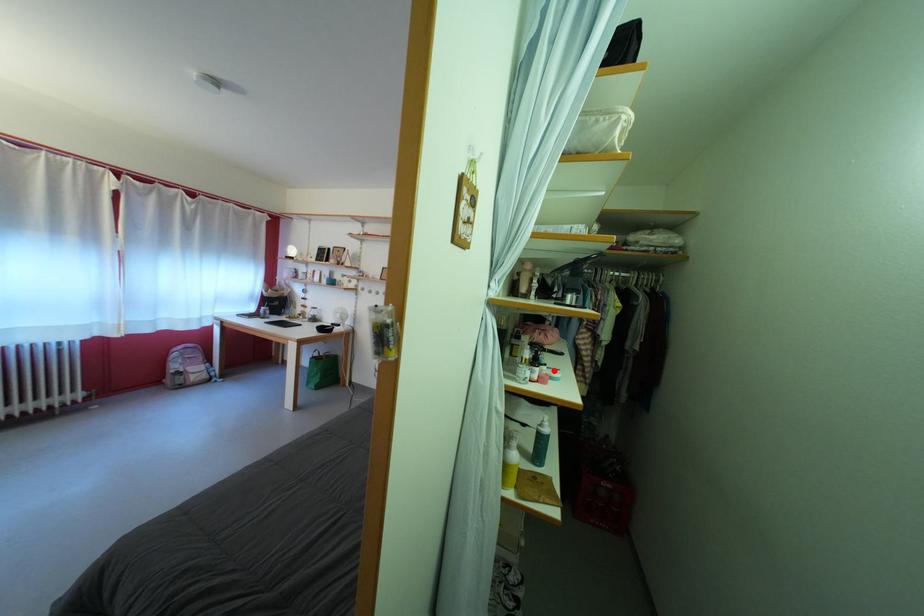
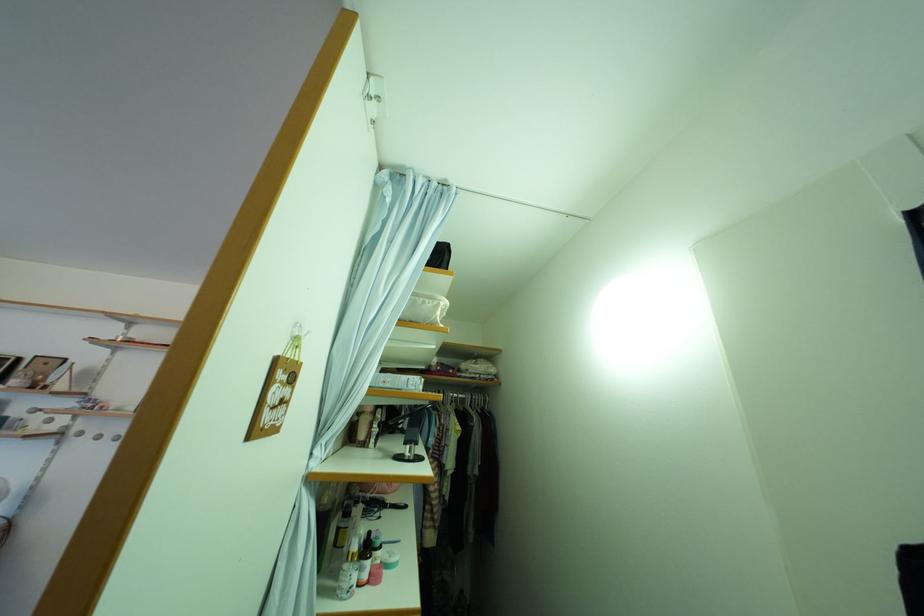
In the second image, find the point that corresponds to the highlighted location in the first image.

(390, 554)